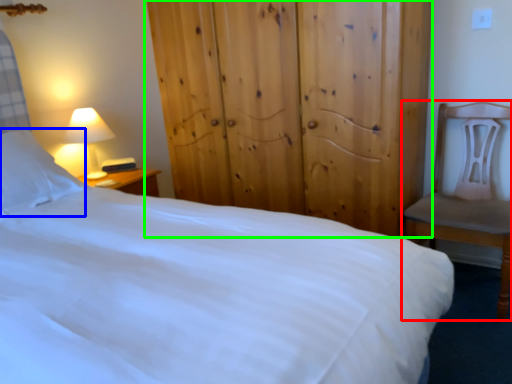
Question: Considering the real-world distances, which object is closest to chair (highlighted by a red box)? pillow (highlighted by a blue box) or dresser (highlighted by a green box).

Choices:
 (A) pillow
 (B) dresser

Answer: (B)